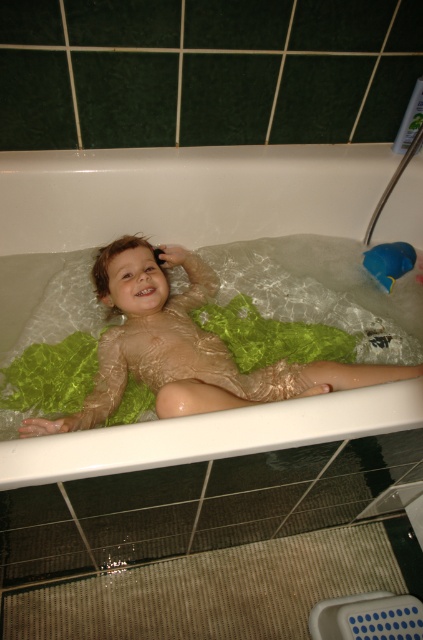
Which is more to the right, translucent plastic bag at center or blue rubber duck at upper right?

blue rubber duck at upper right

Describe the element at coordinates (173, 202) in the screenshot. I see `translucent plastic bag at center` at that location.

You are a GUI agent. You are given a task and a screenshot of the screen. Output one action in this format:
    pyautogui.click(x=<x>, y=<y>)
    Task: Click on the translucent plastic bag at center
    Image resolution: width=423 pixels, height=640 pixels.
    Given the screenshot: What is the action you would take?
    pyautogui.click(x=173, y=202)